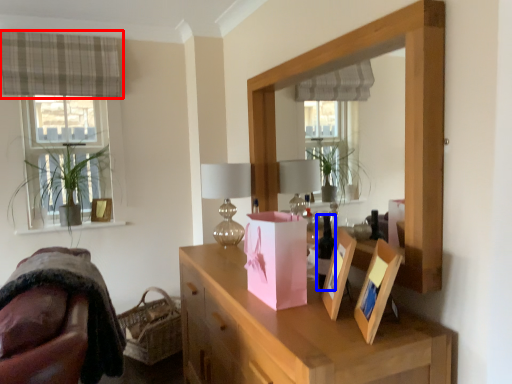
Question: Which point is further to the camera, curtain (highlighted by a red box) or wine bottle (highlighted by a blue box)?

Choices:
 (A) curtain
 (B) wine bottle

Answer: (A)